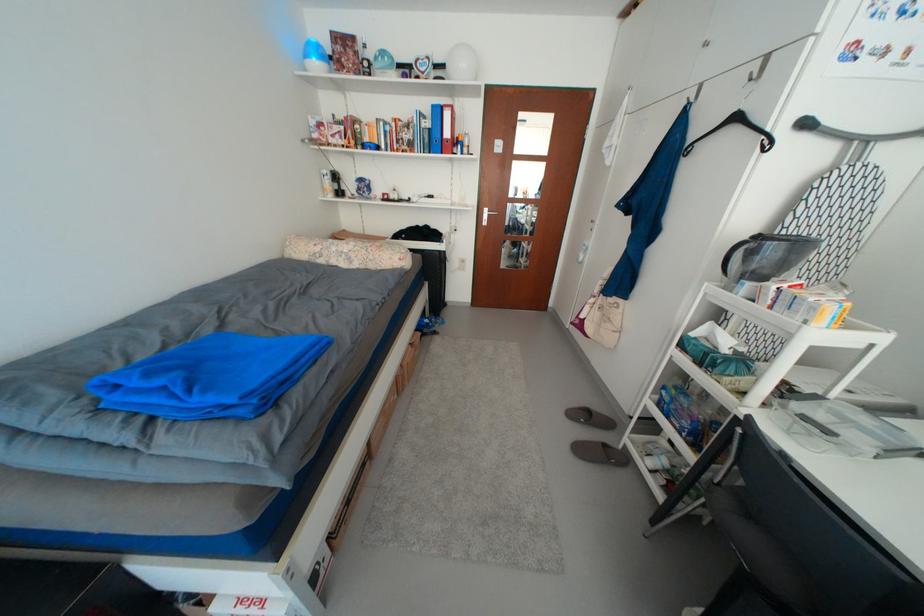
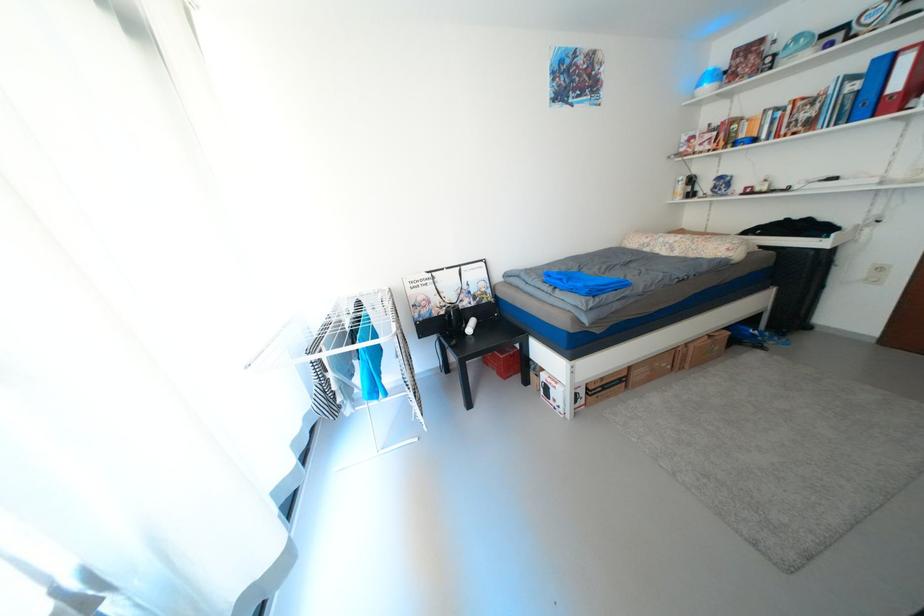
Where in the second image is the point corresponding to pixel 456 116 from the first image?

(916, 62)